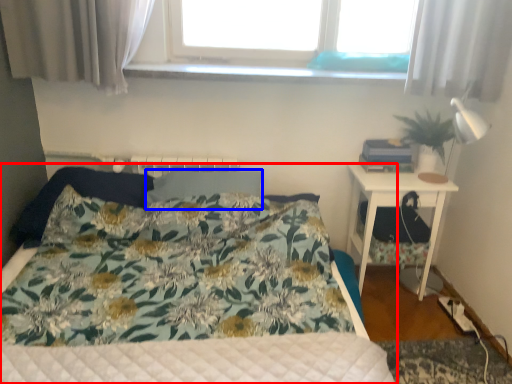
Question: Which point is closer to the camera, bed (highlighted by a red box) or pillow (highlighted by a blue box)?

Choices:
 (A) bed
 (B) pillow

Answer: (A)